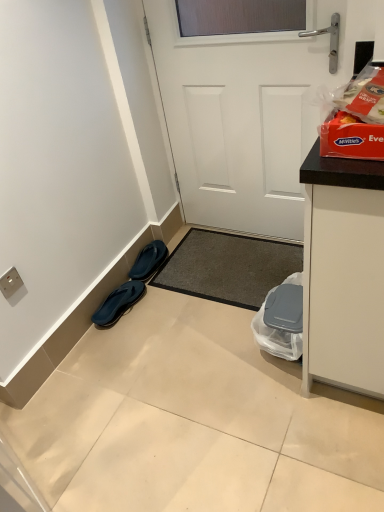
Find the location of a particular element. The width and height of the screenshot is (384, 512). free space between dark gray carpet at center and black rubber flip-flops at lower left, which appears as the 1th footwear when ordered from the bottom is located at coordinates (177, 316).